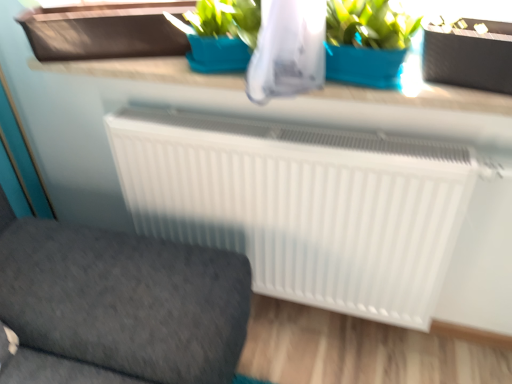
Question: Considering the relative positions of black matte flowerpot at upper right and white smooth counter top at upper center in the image provided, is black matte flowerpot at upper right to the left of white smooth counter top at upper center from the viewer's perspective?

Choices:
 (A) yes
 (B) no

Answer: (B)

Question: From the image's perspective, does black matte flowerpot at upper right appear lower than white smooth counter top at upper center?

Choices:
 (A) yes
 (B) no

Answer: (B)

Question: Is black matte flowerpot at upper right oriented towards white smooth counter top at upper center?

Choices:
 (A) yes
 (B) no

Answer: (B)

Question: Is there a large distance between black matte flowerpot at upper right and white smooth counter top at upper center?

Choices:
 (A) yes
 (B) no

Answer: (B)

Question: Does black matte flowerpot at upper right lie in front of white smooth counter top at upper center?

Choices:
 (A) yes
 (B) no

Answer: (A)

Question: Is white smooth counter top at upper center a part of black matte flowerpot at upper right?

Choices:
 (A) no
 (B) yes

Answer: (A)

Question: Does black matte flowerpot at upper right lie in front of brown matte window box at upper left?

Choices:
 (A) yes
 (B) no

Answer: (A)

Question: Considering the relative sizes of black matte flowerpot at upper right and brown matte window box at upper left in the image provided, is black matte flowerpot at upper right smaller than brown matte window box at upper left?

Choices:
 (A) no
 (B) yes

Answer: (B)

Question: Are black matte flowerpot at upper right and brown matte window box at upper left making contact?

Choices:
 (A) no
 (B) yes

Answer: (A)

Question: Is black matte flowerpot at upper right bigger than brown matte window box at upper left?

Choices:
 (A) yes
 (B) no

Answer: (B)

Question: Could you tell me if black matte flowerpot at upper right is facing brown matte window box at upper left?

Choices:
 (A) no
 (B) yes

Answer: (A)

Question: Is there a large distance between black matte flowerpot at upper right and brown matte window box at upper left?

Choices:
 (A) yes
 (B) no

Answer: (B)

Question: Can you confirm if brown matte window box at upper left is taller than white plastic radiator at center?

Choices:
 (A) yes
 (B) no

Answer: (B)